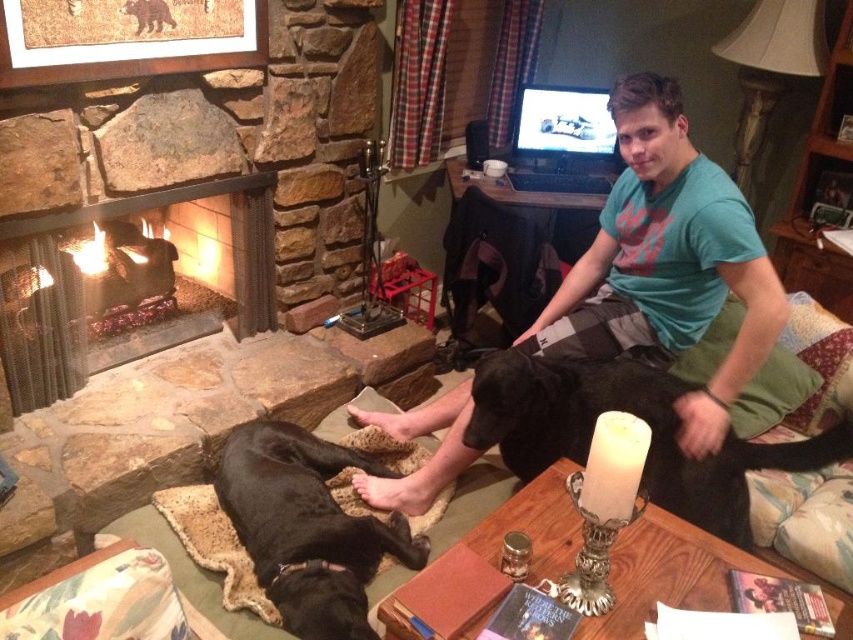
Question: Can you confirm if teal t-shirt at center is positioned to the right of black fur dog at lower center?

Choices:
 (A) no
 (B) yes

Answer: (B)

Question: Which object is positioned closest to the black fur dog at lower left?

Choices:
 (A) black fur dog at lower center
 (B) stone fireplace at left

Answer: (A)

Question: Can you confirm if black fur dog at lower center is smaller than stone fireplace at left?

Choices:
 (A) yes
 (B) no

Answer: (B)

Question: Which of the following is the farthest from the observer?

Choices:
 (A) teal t-shirt at center
 (B) black fur dog at lower left

Answer: (A)

Question: Is the position of black fur dog at lower left more distant than that of stone fireplace at left?

Choices:
 (A) yes
 (B) no

Answer: (B)

Question: Among these points, which one is farthest from the camera?

Choices:
 (A) (252, 326)
 (B) (318, 458)
 (C) (720, 524)

Answer: (A)